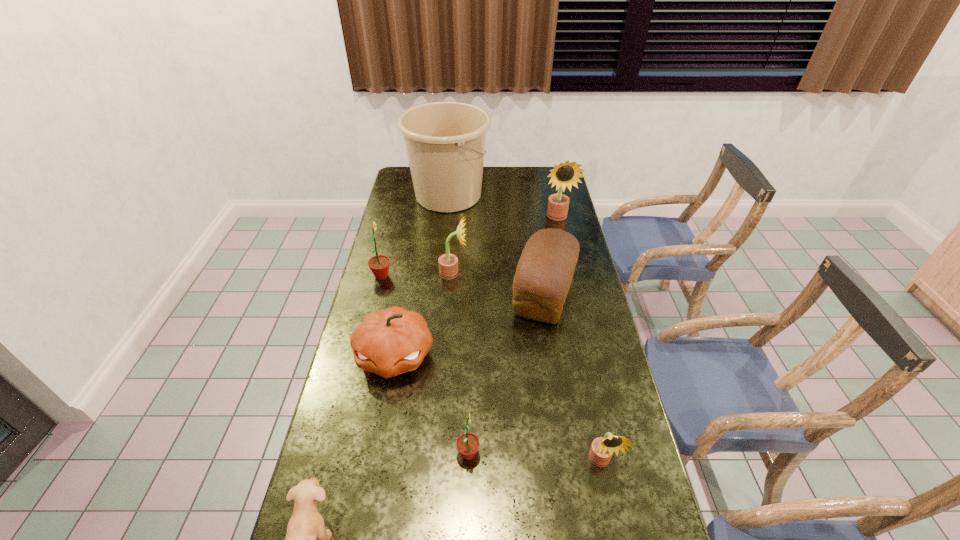
Choose which yellow sunflower is the second nearest neighbor to the eighth shortest object. Please provide its 2D coordinates. Your answer should be formatted as a tuple, i.e. [(x, y)], where the tuple contains the x and y coordinates of a point satisfying the conditions above.

[(602, 448)]

Select which yellow sunflower is the second closest to the nearest yellow sunflower. Please provide its 2D coordinates. Your answer should be formatted as a tuple, i.e. [(x, y)], where the tuple contains the x and y coordinates of a point satisfying the conditions above.

[(566, 173)]

Identify the location of vacant point that satisfies the following two spatial constraints: 1. on the face of the brown bread; 2. on the left side of the second nearest yellow sunflower. click(x=452, y=293).

Where is `free spot that satisfies the following two spatial constraints: 1. on the face of the bigger green sunflower; 2. on the right side of the brown bread`? free spot that satisfies the following two spatial constraints: 1. on the face of the bigger green sunflower; 2. on the right side of the brown bread is located at coordinates click(377, 293).

Find the location of `free location that satisfies the following two spatial constraints: 1. on the face of the brown bread; 2. on the right side of the leftmost yellow sunflower`. free location that satisfies the following two spatial constraints: 1. on the face of the brown bread; 2. on the right side of the leftmost yellow sunflower is located at coordinates (452, 293).

Identify the location of free space in the image that satisfies the following two spatial constraints: 1. on the face of the farther green sunflower; 2. on the left side of the brown bread. The width and height of the screenshot is (960, 540). (377, 293).